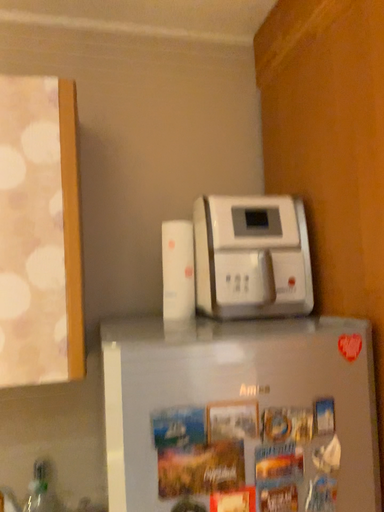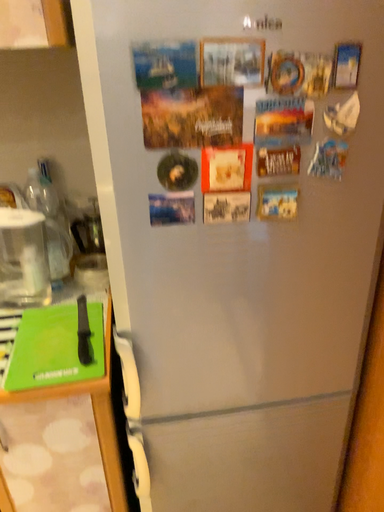
Question: How did the camera likely rotate when shooting the video?

Choices:
 (A) rotated upward
 (B) rotated downward

Answer: (B)